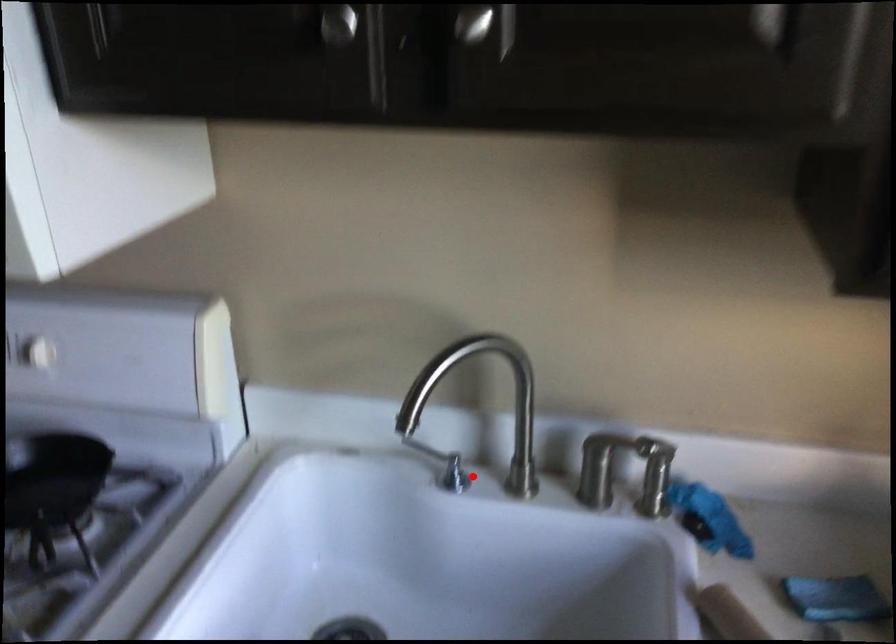
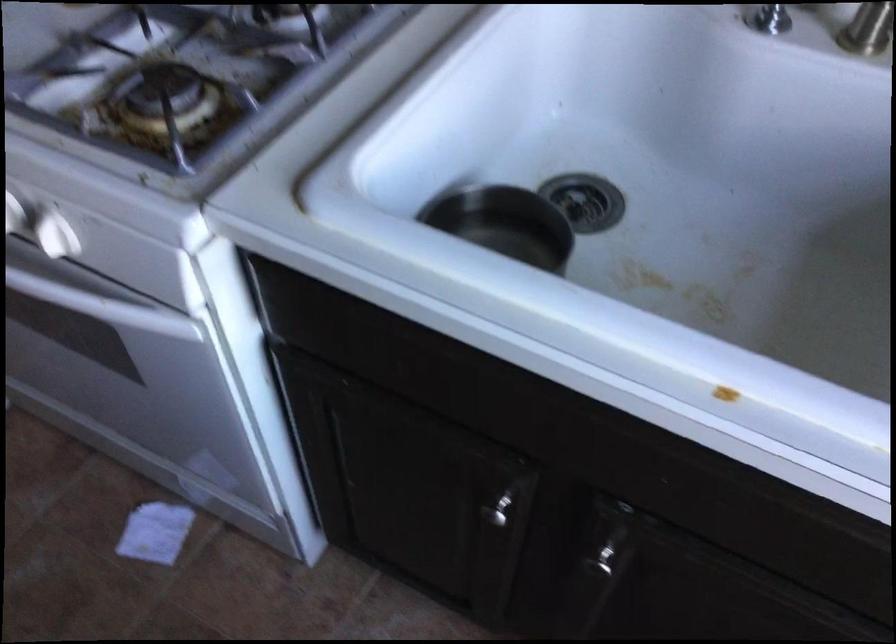
Question: I am providing you with two images of the same scene from different viewpoints. Given a red point in image1, look at the same physical point in image2. Is it:

Choices:
 (A) Closer to the viewpoint
 (B) Farther from the viewpoint

Answer: (A)